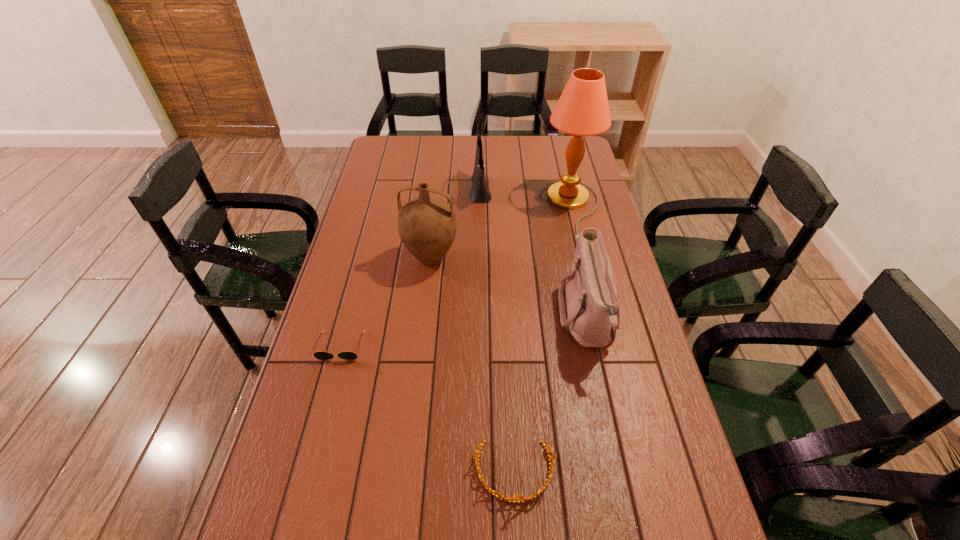
What are the coordinates of `free space between the pitcher and the shortest object` in the screenshot? It's located at (386, 302).

At what (x,y) coordinates should I click in order to perform the action: click on vacant space in between the shortest object and the nearer shoulder bag. Please return your answer as a coordinate pair (x, y). Looking at the image, I should click on (464, 332).

At what (x,y) coordinates should I click in order to perform the action: click on free space that is in between the third shortest object and the tiara. Please return your answer as a coordinate pair (x, y). Looking at the image, I should click on (551, 395).

Identify which object is the closest to the tiara. Please provide its 2D coordinates. Your answer should be formatted as a tuple, i.e. [(x, y)], where the tuple contains the x and y coordinates of a point satisfying the conditions above.

[(589, 305)]

Find the location of a particular element. Image resolution: width=960 pixels, height=540 pixels. object that can be found as the third closest to the fourth tallest object is located at coordinates (427, 225).

Where is `free spot that satisfies the following two spatial constraints: 1. on the front side of the tallest object; 2. on the front pocket of the shorter shoulder bag`? The height and width of the screenshot is (540, 960). free spot that satisfies the following two spatial constraints: 1. on the front side of the tallest object; 2. on the front pocket of the shorter shoulder bag is located at coordinates (597, 319).